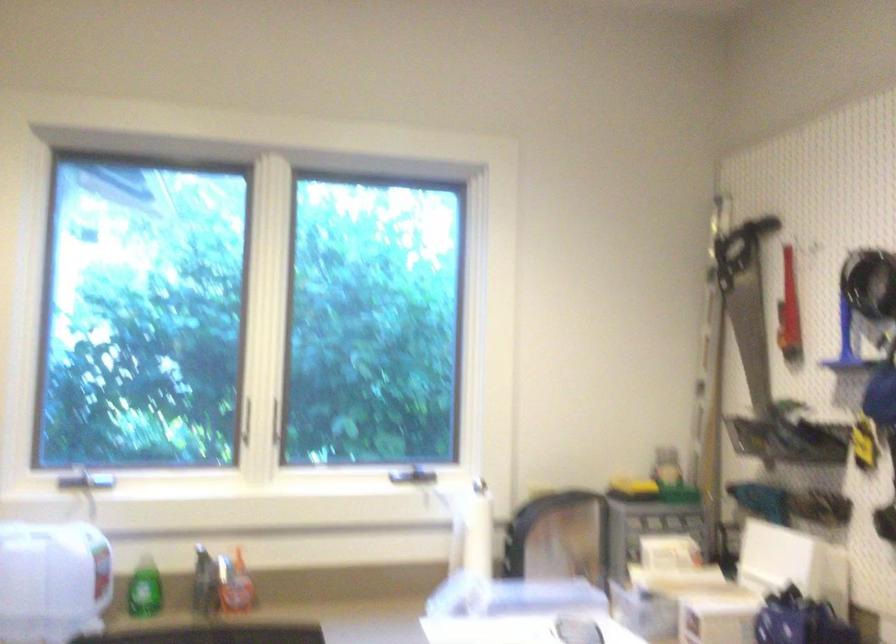
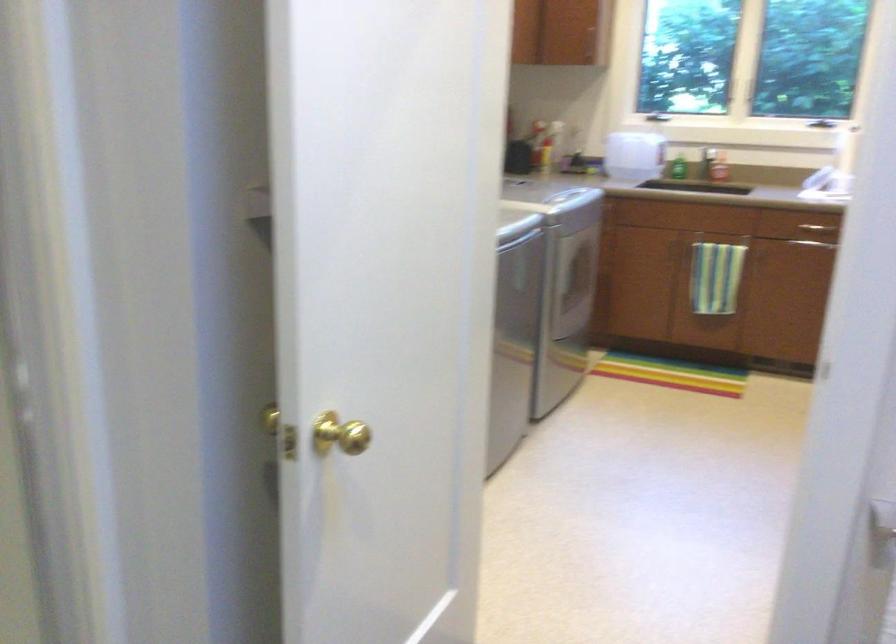
Where in the second image is the point corresponding to (90,498) from the first image?

(655, 116)